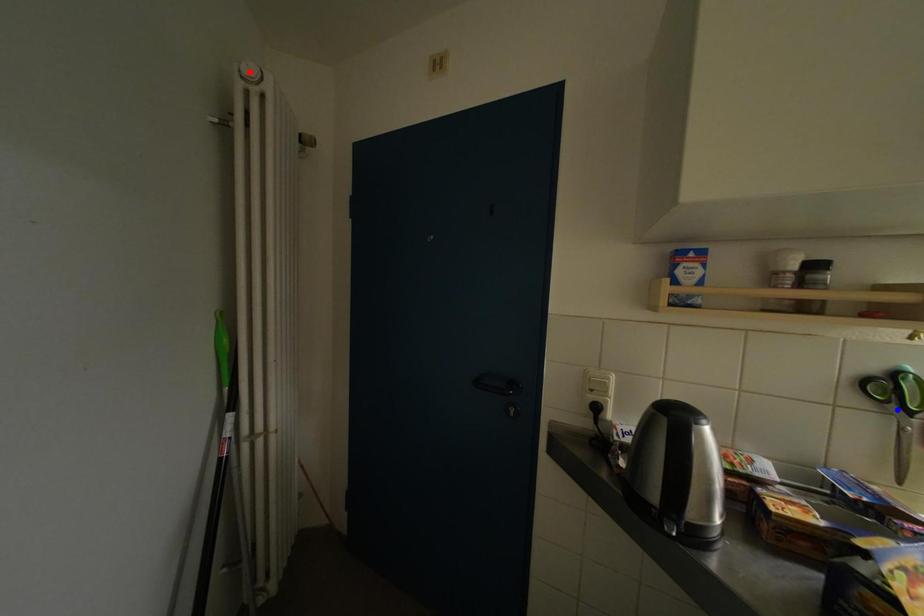
Question: Which of the two points in the image is closer to the camera?

Choices:
 (A) Blue point is closer.
 (B) Red point is closer.

Answer: (A)